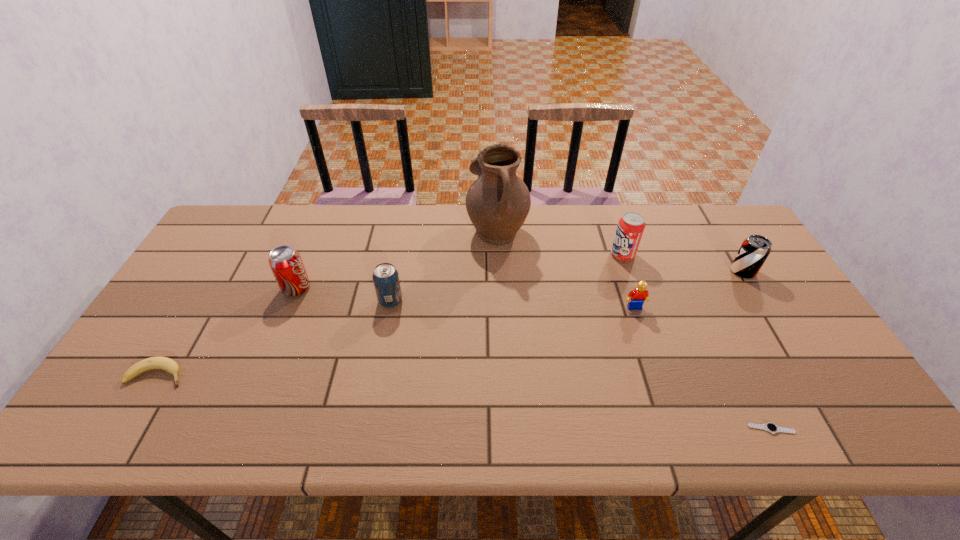
Identify the location of free space at the left edge of the desktop. (160, 388).

Identify the location of vacant space at the right edge of the desktop. (771, 369).

Find the location of a particular element. Image resolution: width=960 pixels, height=540 pixels. vacant area at the far left corner of the desktop is located at coordinates tap(242, 206).

In order to click on blank region between the tallest object and the seventh object from right to left in this screenshot , I will do `click(396, 258)`.

Where is `free space between the seventh tallest object and the rightmost object`? free space between the seventh tallest object and the rightmost object is located at coordinates (450, 323).

This screenshot has height=540, width=960. In order to click on empty space that is in between the banana and the third soda can from right to left in this screenshot , I will do `click(275, 338)`.

At what (x,y) coordinates should I click in order to perform the action: click on vacant area between the third soda can from left to right and the rightmost soda can. Please return your answer as a coordinate pair (x, y). Looking at the image, I should click on (683, 263).

Identify the location of free space between the seventh object from right to left and the second shortest object. (227, 331).

This screenshot has height=540, width=960. I want to click on free spot between the third shortest object and the second soda can from right to left, so [629, 281].

Locate an element on the screen. This screenshot has width=960, height=540. vacant area that lies between the third object from left to right and the fourth object from left to right is located at coordinates (444, 265).